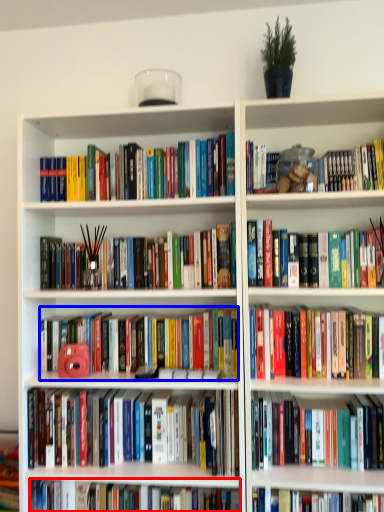
Question: Which point is closer to the camera, book (highlighted by a red box) or book (highlighted by a blue box)?

Choices:
 (A) book
 (B) book

Answer: (A)